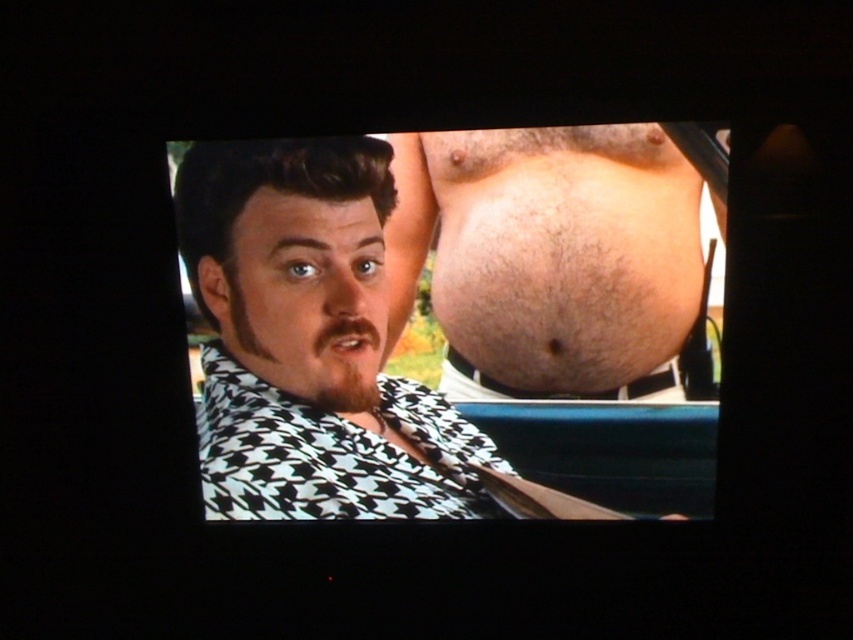
Question: Based on their relative distances, which object is nearer to the black houndstooth scarf at center?

Choices:
 (A) black houndstooth shirt at center
 (B) hairy skin belly at center

Answer: (A)

Question: Which object is the farthest from the black houndstooth shirt at center?

Choices:
 (A) black houndstooth scarf at center
 (B) hairy skin belly at center

Answer: (B)

Question: Is black houndstooth shirt at center to the right of black houndstooth scarf at center from the viewer's perspective?

Choices:
 (A) no
 (B) yes

Answer: (B)

Question: Is hairy skin belly at center wider than black houndstooth scarf at center?

Choices:
 (A) yes
 (B) no

Answer: (A)

Question: Which is nearer to the black houndstooth scarf at center?

Choices:
 (A) hairy skin belly at center
 (B) black houndstooth shirt at center

Answer: (B)

Question: Is black houndstooth shirt at center above hairy skin belly at center?

Choices:
 (A) yes
 (B) no

Answer: (B)